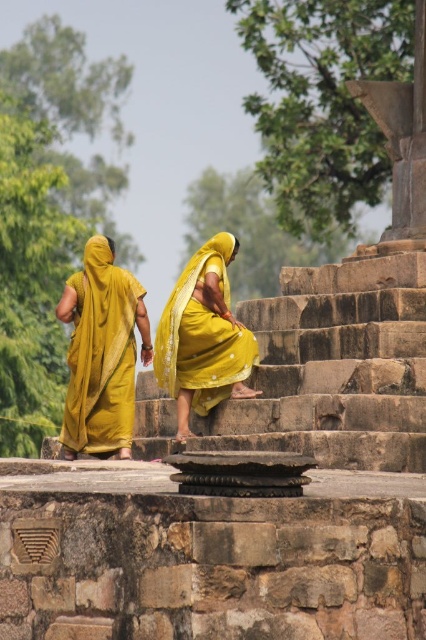
Question: Which point is farther to the camera?

Choices:
 (A) (233, 387)
 (B) (109, 384)

Answer: (B)

Question: Which of the following is the closest to the observer?

Choices:
 (A) click(203, 342)
 (B) click(109, 307)

Answer: (A)

Question: Does matte yellow sari at left appear under yellow silk saree at center?

Choices:
 (A) yes
 (B) no

Answer: (B)

Question: Does matte yellow sari at left have a lesser width compared to yellow silk saree at center?

Choices:
 (A) yes
 (B) no

Answer: (B)

Question: Can you confirm if matte yellow sari at left is wider than yellow silk saree at center?

Choices:
 (A) yes
 (B) no

Answer: (A)